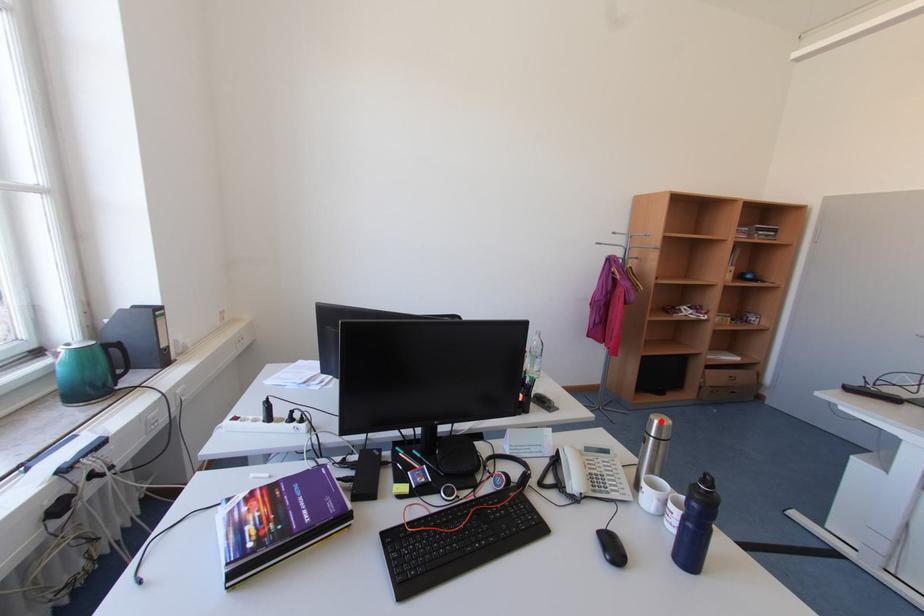
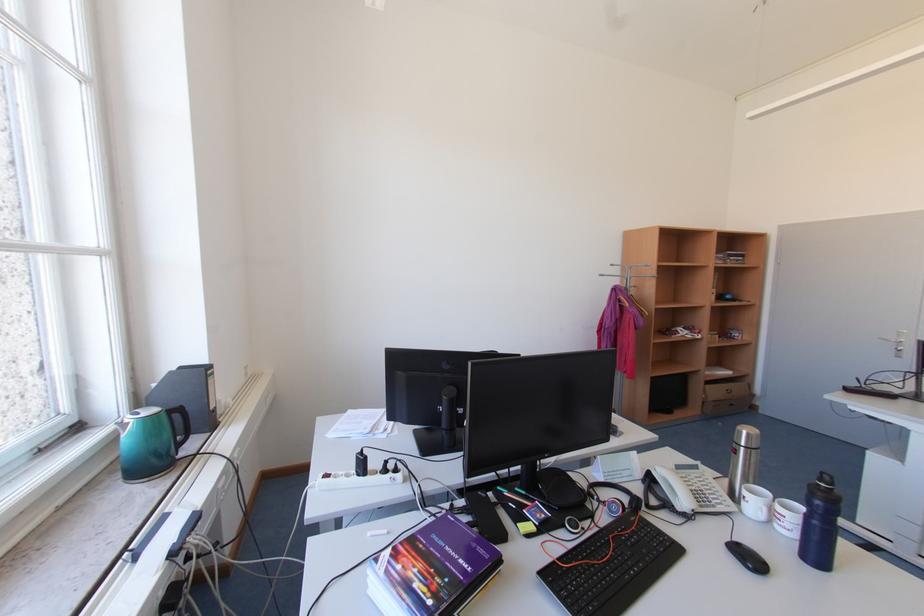
Question: I am providing you with two images of the same scene from different viewpoints. Image1 has a red point marked. In image2, the corresponding 3D location appears at what relative position? Reply with the corresponding letter.

Choices:
 (A) Closer
 (B) Farther

Answer: (B)